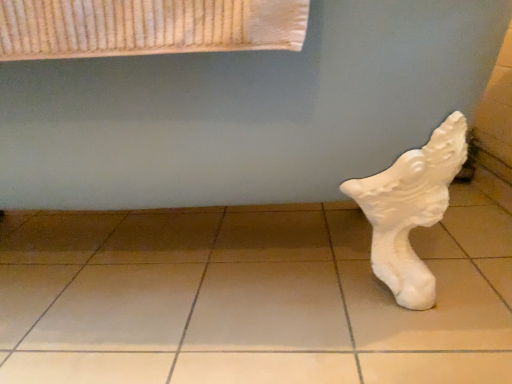
Locate an element on the screen. white matte sculpture at lower right is located at coordinates (245, 111).

Describe the element at coordinates (245, 111) in the screenshot. The image size is (512, 384). I see `white matte sculpture at lower right` at that location.

This screenshot has width=512, height=384. Describe the element at coordinates (249, 297) in the screenshot. I see `white matte tile at lower right` at that location.

Locate an element on the screen. The height and width of the screenshot is (384, 512). white matte tile at lower right is located at coordinates (249, 297).

Locate an element on the screen. The image size is (512, 384). white matte sculpture at lower right is located at coordinates (245, 111).

Can you confirm if white matte tile at lower right is positioned to the left of white matte sculpture at lower right?

No.

Is the position of white matte tile at lower right more distant than that of white matte sculpture at lower right?

Yes.

Is point (55, 353) farther from camera compared to point (48, 154)?

Yes, it is behind point (48, 154).

From the image's perspective, relative to white matte sculpture at lower right, is white matte tile at lower right above or below?

Clearly, from the image's perspective, white matte tile at lower right is below white matte sculpture at lower right.

From a real-world perspective, is white matte tile at lower right located beneath white matte sculpture at lower right?

Yes, from a real-world perspective, white matte tile at lower right is below white matte sculpture at lower right.

Looking at their sizes, would you say white matte tile at lower right is wider or thinner than white matte sculpture at lower right?

Considering their sizes, white matte tile at lower right looks broader than white matte sculpture at lower right.

Does white matte tile at lower right have a lesser height compared to white matte sculpture at lower right?

Indeed, white matte tile at lower right has a lesser height compared to white matte sculpture at lower right.

Based on their sizes in the image, would you say white matte tile at lower right is bigger or smaller than white matte sculpture at lower right?

Considering their sizes, white matte tile at lower right takes up less space than white matte sculpture at lower right.

Is white matte tile at lower right located outside white matte sculpture at lower right?

→ Yes, white matte tile at lower right is not within white matte sculpture at lower right.

Can you see white matte tile at lower right touching white matte sculpture at lower right?

white matte tile at lower right and white matte sculpture at lower right are clearly separated.

Is white matte tile at lower right facing away from white matte sculpture at lower right?

white matte tile at lower right is not turned away from white matte sculpture at lower right.

Looking at this image, what's the angular difference between white matte tile at lower right and white matte sculpture at lower right's facing directions?

white matte tile at lower right and white matte sculpture at lower right are facing 89.9 degrees away from each other.

How distant is white matte tile at lower right from white matte sculpture at lower right?

white matte tile at lower right and white matte sculpture at lower right are 14.66 inches apart.

Identify the location of bath that appears above the white matte tile at lower right (from the image's perspective). (245, 111).

Between white matte sculpture at lower right and white matte tile at lower right, which one appears on the left side from the viewer's perspective?

white matte sculpture at lower right.

Considering their positions, is white matte sculpture at lower right located in front of or behind white matte tile at lower right?

Clearly, white matte sculpture at lower right is in front of white matte tile at lower right.

Between point (132, 152) and point (325, 340), which one is positioned behind?

The point (325, 340) is more distant.

From the image's perspective, which is above, white matte sculpture at lower right or white matte tile at lower right?

white matte sculpture at lower right is shown above in the image.

Based on the photo, from a real-world perspective, is white matte sculpture at lower right physically above white matte tile at lower right?

Indeed, from a real-world perspective, white matte sculpture at lower right stands above white matte tile at lower right.

Considering the relative sizes of white matte sculpture at lower right and white matte tile at lower right in the image provided, is white matte sculpture at lower right thinner than white matte tile at lower right?

Yes, white matte sculpture at lower right is thinner than white matte tile at lower right.

Can you confirm if white matte sculpture at lower right is shorter than white matte tile at lower right?

Incorrect, the height of white matte sculpture at lower right does not fall short of that of white matte tile at lower right.

Who is smaller, white matte sculpture at lower right or white matte tile at lower right?

Smaller between the two is white matte tile at lower right.

Do you think white matte sculpture at lower right is within white matte tile at lower right, or outside of it?

white matte sculpture at lower right is spatially situated outside white matte tile at lower right.

Is white matte sculpture at lower right next to white matte tile at lower right?

white matte sculpture at lower right and white matte tile at lower right are not in contact.

Is white matte sculpture at lower right turned away from white matte tile at lower right?

No, white matte sculpture at lower right's orientation is not away from white matte tile at lower right.

Can you tell me how much white matte sculpture at lower right and white matte tile at lower right differ in facing direction?

The angular difference between white matte sculpture at lower right and white matte tile at lower right is 89.9 degrees.

How much distance is there between white matte sculpture at lower right and white matte tile at lower right?

white matte sculpture at lower right is 14.66 inches away from white matte tile at lower right.

Identify the location of tile below the white matte sculpture at lower right (from the image's perspective). The height and width of the screenshot is (384, 512). (249, 297).

In the image, there is a white matte tile at lower right. Identify the location of bath above it (from the image's perspective). (245, 111).

I want to click on tile that appears below the white matte sculpture at lower right (from a real-world perspective), so click(x=249, y=297).